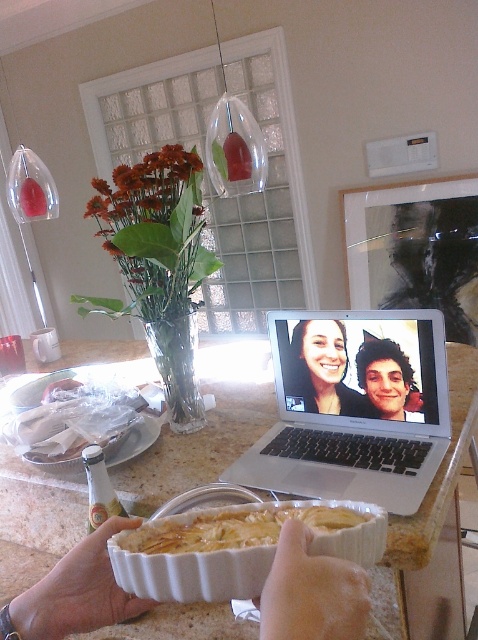
Question: Which object is closer to the camera taking this photo?

Choices:
 (A) white ceramic dish at center
 (B) golden brown flaky pastry at center
 (C) matte black laptop at center

Answer: (A)

Question: Among these points, which one is nearest to the camera?

Choices:
 (A) (206, 512)
 (B) (276, 588)
 (C) (379, 371)

Answer: (B)

Question: Is white matte hand at center behind golden brown flaky pastry at center?

Choices:
 (A) no
 (B) yes

Answer: (B)

Question: Does white matte hand at center appear over golden brown flaky pastry at center?

Choices:
 (A) yes
 (B) no

Answer: (B)

Question: Which is nearer to the white matte hand at center?

Choices:
 (A) silver metallic laptop at center
 (B) matte black laptop at center

Answer: (A)

Question: Is granite countertop at center positioned behind matte black laptop at center?

Choices:
 (A) no
 (B) yes

Answer: (A)